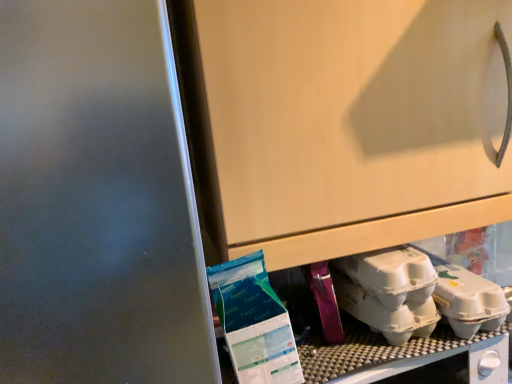
Question: Can you confirm if white matte egg carton at lower right, arranged as the second yoghurt when viewed from the left, is wider than blue plastic bag of yoghurt at lower left, positioned as the 2th yoghurt in right-to-left order?

Choices:
 (A) no
 (B) yes

Answer: (B)

Question: Is the surface of white matte egg carton at lower right, which is the first yoghurt in right-to-left order, in direct contact with blue plastic bag of yoghurt at lower left, placed as the first yoghurt when sorted from left to right?

Choices:
 (A) no
 (B) yes

Answer: (A)

Question: Is white matte egg carton at lower right, arranged as the second yoghurt when viewed from the left, far away from blue plastic bag of yoghurt at lower left, positioned as the 2th yoghurt in right-to-left order?

Choices:
 (A) no
 (B) yes

Answer: (A)

Question: Is white matte egg carton at lower right, arranged as the second yoghurt when viewed from the left, positioned beyond the bounds of blue plastic bag of yoghurt at lower left, positioned as the 2th yoghurt in right-to-left order?

Choices:
 (A) yes
 (B) no

Answer: (A)

Question: From a real-world perspective, is white matte egg carton at lower right, which is the first yoghurt in right-to-left order, physically above blue plastic bag of yoghurt at lower left, positioned as the 2th yoghurt in right-to-left order?

Choices:
 (A) yes
 (B) no

Answer: (B)

Question: Is white matte egg carton at lower right, which is the first yoghurt in right-to-left order, facing towards blue plastic bag of yoghurt at lower left, positioned as the 2th yoghurt in right-to-left order?

Choices:
 (A) yes
 (B) no

Answer: (B)

Question: Considering the relative positions of blue plastic bag of yoghurt at lower left, positioned as the 2th yoghurt in right-to-left order, and white matte egg carton at lower right, which is the first yoghurt in right-to-left order, in the image provided, is blue plastic bag of yoghurt at lower left, positioned as the 2th yoghurt in right-to-left order, behind white matte egg carton at lower right, which is the first yoghurt in right-to-left order,?

Choices:
 (A) no
 (B) yes

Answer: (A)

Question: From the image's perspective, is blue plastic bag of yoghurt at lower left, positioned as the 2th yoghurt in right-to-left order, over white matte egg carton at lower right, arranged as the second yoghurt when viewed from the left?

Choices:
 (A) yes
 (B) no

Answer: (A)

Question: From the image's perspective, is blue plastic bag of yoghurt at lower left, placed as the first yoghurt when sorted from left to right, below white matte egg carton at lower right, arranged as the second yoghurt when viewed from the left?

Choices:
 (A) yes
 (B) no

Answer: (B)

Question: Can you confirm if blue plastic bag of yoghurt at lower left, positioned as the 2th yoghurt in right-to-left order, is bigger than white matte egg carton at lower right, arranged as the second yoghurt when viewed from the left?

Choices:
 (A) yes
 (B) no

Answer: (A)

Question: Is blue plastic bag of yoghurt at lower left, positioned as the 2th yoghurt in right-to-left order, oriented away from white matte egg carton at lower right, which is the first yoghurt in right-to-left order?

Choices:
 (A) yes
 (B) no

Answer: (B)

Question: From a real-world perspective, does blue plastic bag of yoghurt at lower left, positioned as the 2th yoghurt in right-to-left order, sit lower than white matte egg carton at lower right, which is the first yoghurt in right-to-left order?

Choices:
 (A) no
 (B) yes

Answer: (A)

Question: Visually, is white matte egg carton at lower right, which is the first yoghurt in right-to-left order, positioned to the left or to the right of blue plastic bag of yoghurt at lower left, positioned as the 2th yoghurt in right-to-left order?

Choices:
 (A) left
 (B) right

Answer: (B)